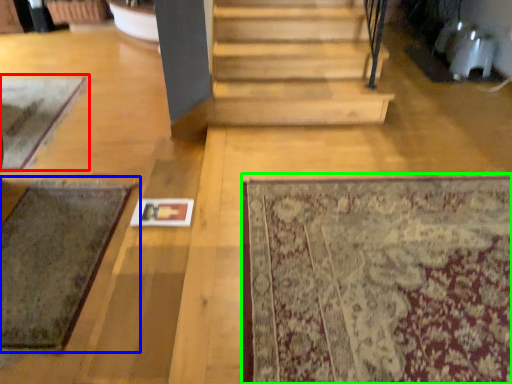
Question: Estimate the real-world distances between objects in this image. Which object is farther from mat (highlighted by a red box), mat (highlighted by a blue box) or mat (highlighted by a green box)?

Choices:
 (A) mat
 (B) mat

Answer: (B)